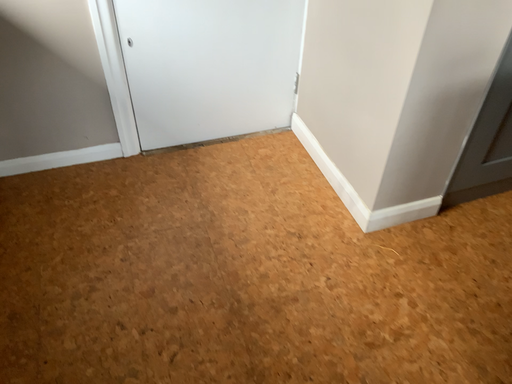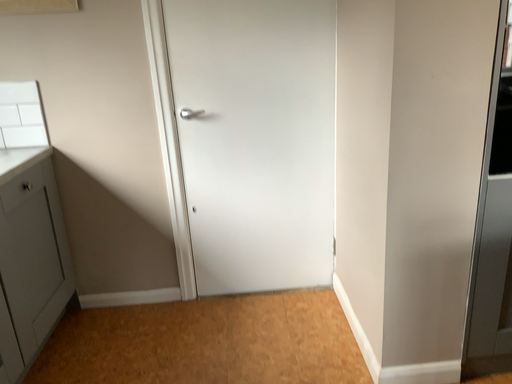
Question: How did the camera likely rotate when shooting the video?

Choices:
 (A) rotated downward
 (B) rotated upward

Answer: (B)